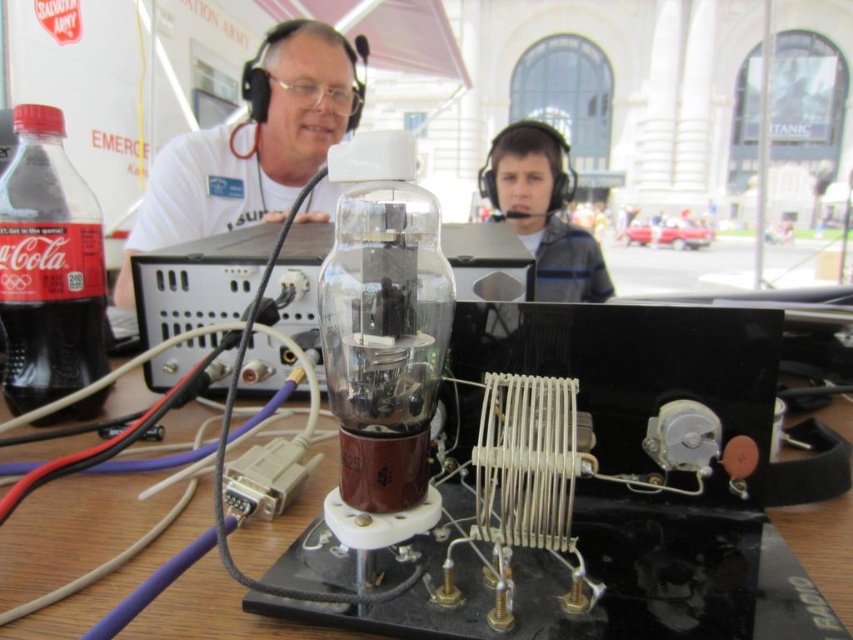
You are an engineer inspecting the electronic setup in the scene. You need to determine if the white matte glass tube at center can be placed horizontally on a shelf that is the same width as the matte gray hoodie at center. Can it fit?

The white matte glass tube at center is wider than the matte gray hoodie at center, so it cannot fit on a shelf that is the same width as the matte gray hoodie at center.

You are an engineer inspecting the electronic setup. You need to access the red matte plastic bottle at left, which is behind the white matte glass tube at center. Can you reach it without moving the tube?

The white matte glass tube at center is above the red matte plastic bottle at left, so you can reach the red matte plastic bottle at left by accessing it from below the tube.

You are a technician who needs to connect the white matte glass tube at center to another device located 1.5 meters away. Do you think a 1.41 meter long cable will be sufficient?

The distance between the white matte glass tube at center and the other device is 1.41 meters. A 1.41 meter long cable will just reach, but it might be too tight. It is recommended to use a slightly longer cable for easier handling.